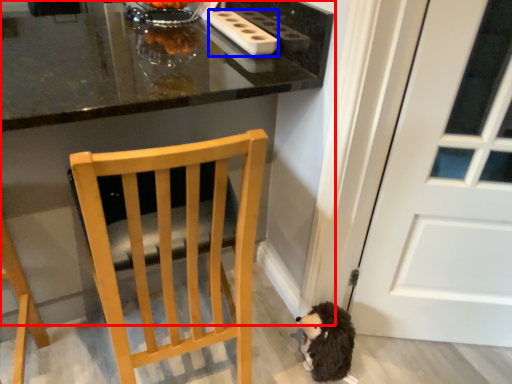
Question: Among these objects, which one is farthest to the camera, table (highlighted by a red box) or appliance (highlighted by a blue box)?

Choices:
 (A) table
 (B) appliance

Answer: (B)